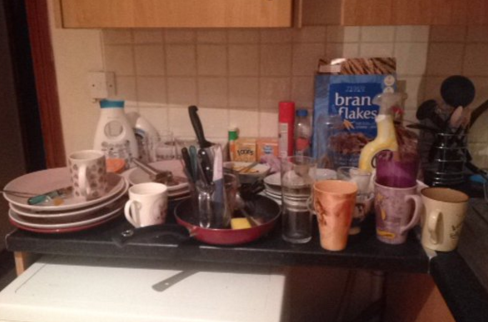
You are a GUI agent. You are given a task and a screenshot of the screen. Output one action in this format:
    pyautogui.click(x=<x>, y=<y>)
    Task: Click on the coffee cups
    
    Given the screenshot: What is the action you would take?
    pyautogui.click(x=83, y=166), pyautogui.click(x=160, y=207), pyautogui.click(x=342, y=213), pyautogui.click(x=390, y=217), pyautogui.click(x=443, y=233)